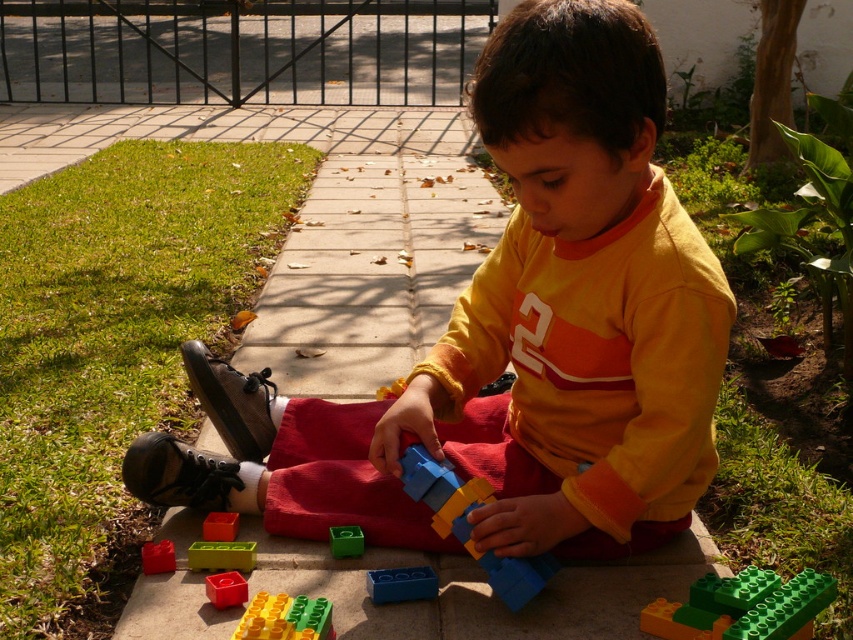
You are a parent trying to clean up the toys. You see the bright yellow plastic blocks at lower center and the green plastic toy at lower center. Which one is on the right side when looking from the child?

The bright yellow plastic blocks at lower center are on the right side of the green plastic toy at lower center when looking from the child.

You are a parent trying to locate your child who is playing with blue plastic brick at center. Based on the coordinates provided, where should you look relative to the child?

The blue plastic brick at center is located at coordinates point (x=401, y=584), so you should look at the center of the image where the child is playing.

You are a parent trying to help your child build a tower with the blue plastic brick at center and the translucent plastic brick at lower center. Which brick should you place at the bottom to make the tower more stable?

You should place the blue plastic brick at center at the bottom because it is much taller than the translucent plastic brick at lower center, providing a more stable base.